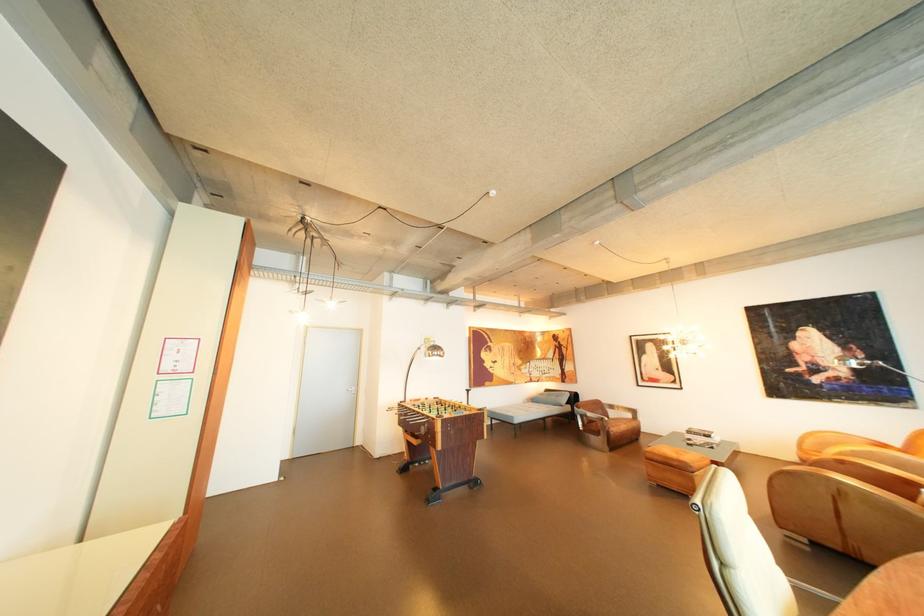
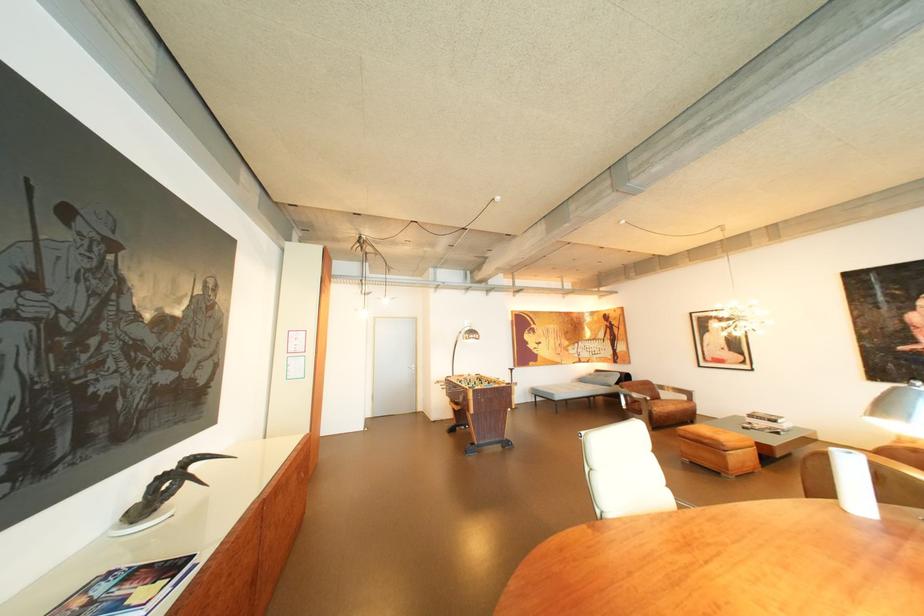
Where in the second image is the point corresponding to pixel 602 416 from the first image?

(649, 395)